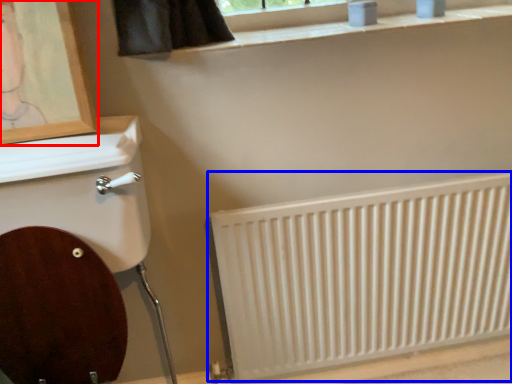
Question: Which object is closer to the camera taking this photo, picture frame (highlighted by a red box) or radiator (highlighted by a blue box)?

Choices:
 (A) picture frame
 (B) radiator

Answer: (A)